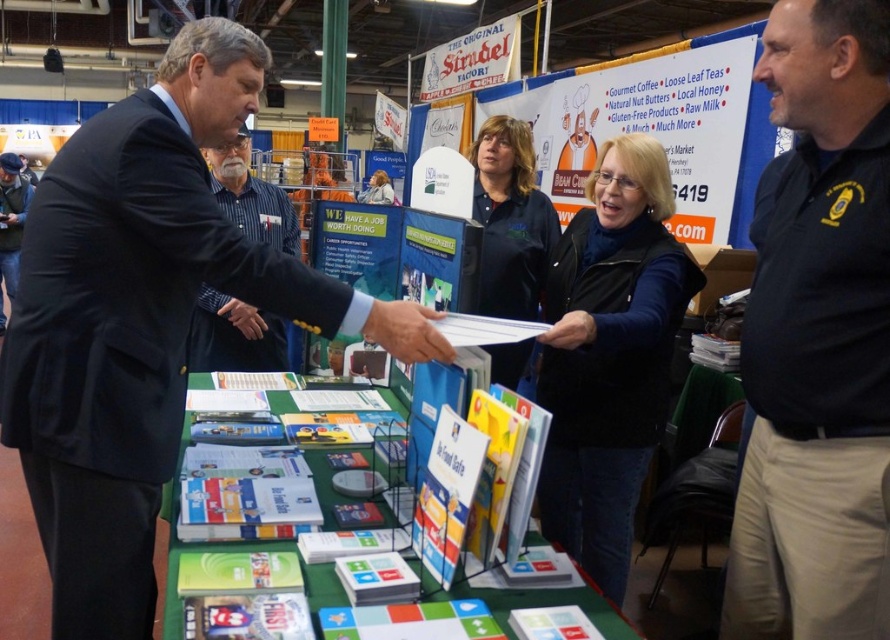
You are a photographer at the event and want to take a photo of both the dark blue suit at center and the matte black jacket at center. Which one should you focus on first to ensure both are in focus?

The dark blue suit at center is in front of the matte black jacket at center, so you should focus on the matte black jacket at center first to ensure both are in focus.